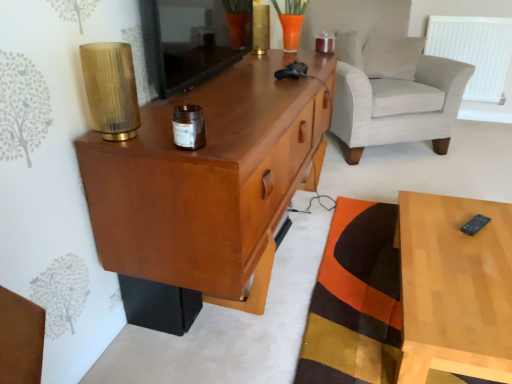
Find the location of `vacant region to the left of light brown wood at right`. vacant region to the left of light brown wood at right is located at coordinates (319, 310).